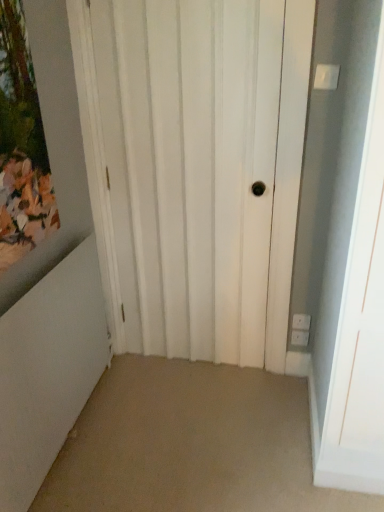
Question: From the image's perspective, would you say wooden painted picture frame at upper left is positioned over white matte door at center?

Choices:
 (A) no
 (B) yes

Answer: (B)

Question: Could you tell me if wooden painted picture frame at upper left is facing white matte door at center?

Choices:
 (A) yes
 (B) no

Answer: (B)

Question: From the image's perspective, is wooden painted picture frame at upper left under white matte door at center?

Choices:
 (A) yes
 (B) no

Answer: (B)

Question: Is wooden painted picture frame at upper left positioned beyond the bounds of white matte door at center?

Choices:
 (A) yes
 (B) no

Answer: (A)

Question: Is wooden painted picture frame at upper left at the left side of white matte door at center?

Choices:
 (A) yes
 (B) no

Answer: (A)

Question: Considering the relative sizes of wooden painted picture frame at upper left and white matte door at center in the image provided, is wooden painted picture frame at upper left taller than white matte door at center?

Choices:
 (A) no
 (B) yes

Answer: (A)

Question: Is the depth of white matte door at center greater than that of wooden painted picture frame at upper left?

Choices:
 (A) yes
 (B) no

Answer: (A)

Question: Does white matte door at center have a larger size compared to wooden painted picture frame at upper left?

Choices:
 (A) yes
 (B) no

Answer: (A)

Question: Is white matte door at center looking in the opposite direction of wooden painted picture frame at upper left?

Choices:
 (A) yes
 (B) no

Answer: (B)

Question: Is white matte door at center outside wooden painted picture frame at upper left?

Choices:
 (A) yes
 (B) no

Answer: (A)

Question: Is white matte door at center shorter than wooden painted picture frame at upper left?

Choices:
 (A) no
 (B) yes

Answer: (A)

Question: From a real-world perspective, is white matte door at center on top of wooden painted picture frame at upper left?

Choices:
 (A) no
 (B) yes

Answer: (A)

Question: Is point (11, 302) closer or farther from the camera than point (125, 86)?

Choices:
 (A) farther
 (B) closer

Answer: (B)